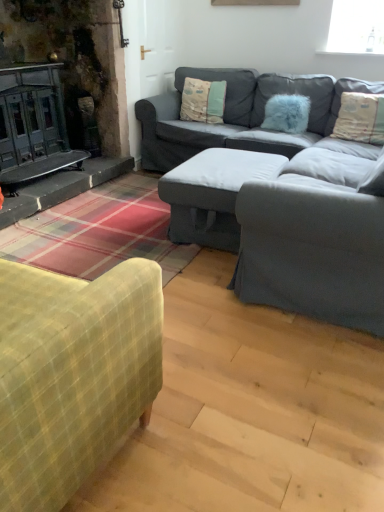
Where is `dark gray fabric couch at center`? dark gray fabric couch at center is located at coordinates (239, 115).

Where is `textured beige pillow at center, the first pillow in the left-to-right sequence`? The height and width of the screenshot is (512, 384). textured beige pillow at center, the first pillow in the left-to-right sequence is located at coordinates (203, 100).

What is the approximate width of fuzzy blue pillow at center, which is the second pillow from left to right?

It is 24.35 centimeters.

Locate an element on the screen. The width and height of the screenshot is (384, 512). fuzzy blue pillow at center, which is counted as the second pillow, starting from the right is located at coordinates (287, 113).

What is the approximate height of velvet green sofa at center?

velvet green sofa at center is 32.36 inches in height.

Where is `dark gray fabric couch at center`? This screenshot has height=512, width=384. dark gray fabric couch at center is located at coordinates (239, 115).

Measure the distance from dark gray fabric couch at center to white fabric ottoman at center.

dark gray fabric couch at center and white fabric ottoman at center are 30.28 inches apart.

Could you tell me if dark gray fabric couch at center is turned towards white fabric ottoman at center?

Yes.

How many degrees apart are the facing directions of dark gray fabric couch at center and white fabric ottoman at center?

The facing directions of dark gray fabric couch at center and white fabric ottoman at center are 87.4 degrees apart.

In terms of size, does dark gray fabric couch at center appear bigger or smaller than white fabric ottoman at center?

Clearly, dark gray fabric couch at center is larger in size than white fabric ottoman at center.

From the image's perspective, is fluffy cream pillow at upper right, which appears as the 1th pillow when viewed from the right, positioned above or below textured gray armchair at center?

fluffy cream pillow at upper right, which appears as the 1th pillow when viewed from the right, is above textured gray armchair at center.

Is fluffy cream pillow at upper right, which appears as the 1th pillow when viewed from the right, aimed at textured gray armchair at center?

Yes.

Is fluffy cream pillow at upper right, which appears as the 1th pillow when viewed from the right, wider than textured gray armchair at center?

No, fluffy cream pillow at upper right, which appears as the 1th pillow when viewed from the right, is not wider than textured gray armchair at center.

How different are the orientations of fluffy cream pillow at upper right, which appears as the 1th pillow when viewed from the right, and textured gray armchair at center in degrees?

88.6 degrees separate the facing orientations of fluffy cream pillow at upper right, which appears as the 1th pillow when viewed from the right, and textured gray armchair at center.

Which of these two, textured beige pillow at center, acting as the third pillow starting from the right, or velvet green sofa at center, is smaller?

textured beige pillow at center, acting as the third pillow starting from the right.

From the image's perspective, which one is positioned lower, textured beige pillow at center, acting as the third pillow starting from the right, or velvet green sofa at center?

velvet green sofa at center.

Is textured beige pillow at center, the first pillow in the left-to-right sequence, oriented towards velvet green sofa at center?

Yes, textured beige pillow at center, the first pillow in the left-to-right sequence, faces towards velvet green sofa at center.

From a real-world perspective, relative to velvet green sofa at center, is textured beige pillow at center, acting as the third pillow starting from the right, vertically above or below?

textured beige pillow at center, acting as the third pillow starting from the right, is situated higher than velvet green sofa at center in the real world.

In the scene shown: How different are the orientations of dark gray fabric couch at center and fluffy cream pillow at upper right, which appears as the 1th pillow when viewed from the right, in degrees?

1.49 degrees separate the facing orientations of dark gray fabric couch at center and fluffy cream pillow at upper right, which appears as the 1th pillow when viewed from the right.

Is dark gray fabric couch at center in front of or behind fluffy cream pillow at upper right, the third pillow positioned from the left, in the image?

Visually, dark gray fabric couch at center is located in front of fluffy cream pillow at upper right, the third pillow positioned from the left.

From a real-world perspective, is dark gray fabric couch at center over fluffy cream pillow at upper right, the third pillow positioned from the left?

No, from a real-world perspective, dark gray fabric couch at center is not over fluffy cream pillow at upper right, the third pillow positioned from the left

Considering the sizes of textured gray armchair at center and white fabric ottoman at center in the image, is textured gray armchair at center wider or thinner than white fabric ottoman at center?

Considering their sizes, textured gray armchair at center looks broader than white fabric ottoman at center.

Considering the relative sizes of textured gray armchair at center and white fabric ottoman at center in the image provided, is textured gray armchair at center taller than white fabric ottoman at center?

Yes.

Measure the distance from fuzzy blue pillow at center, which is counted as the second pillow, starting from the right, to fluffy cream pillow at upper right, the third pillow positioned from the left.

fuzzy blue pillow at center, which is counted as the second pillow, starting from the right, is 16.44 inches from fluffy cream pillow at upper right, the third pillow positioned from the left.

The height and width of the screenshot is (512, 384). What are the coordinates of `pillow in front of the fuzzy blue pillow at center, which is counted as the second pillow, starting from the right` in the screenshot? It's located at (360, 118).

Which of these two, fuzzy blue pillow at center, which is counted as the second pillow, starting from the right, or fluffy cream pillow at upper right, the third pillow positioned from the left, is wider?

fluffy cream pillow at upper right, the third pillow positioned from the left.

Considering their positions, is fuzzy blue pillow at center, which is the second pillow from left to right, located in front of or behind fluffy cream pillow at upper right, which appears as the 1th pillow when viewed from the right?

fuzzy blue pillow at center, which is the second pillow from left to right, is behind fluffy cream pillow at upper right, which appears as the 1th pillow when viewed from the right.

Considering the sizes of objects white fabric ottoman at center and fuzzy blue pillow at center, which is the second pillow from left to right, in the image provided, who is smaller, white fabric ottoman at center or fuzzy blue pillow at center, which is the second pillow from left to right,?

fuzzy blue pillow at center, which is the second pillow from left to right.

Between point (253, 174) and point (293, 112), which one is positioned in front?

Point (253, 174)

How different are the orientations of white fabric ottoman at center and fuzzy blue pillow at center, which is the second pillow from left to right, in degrees?

white fabric ottoman at center and fuzzy blue pillow at center, which is the second pillow from left to right, are facing 83.7 degrees away from each other.

Does white fabric ottoman at center have a lesser height compared to fuzzy blue pillow at center, which is counted as the second pillow, starting from the right?

No, white fabric ottoman at center is not shorter than fuzzy blue pillow at center, which is counted as the second pillow, starting from the right.

The image size is (384, 512). Find the location of `couch behind the white fabric ottoman at center`. couch behind the white fabric ottoman at center is located at coordinates (239, 115).

Identify the location of armchair in front of the fluffy cream pillow at upper right, the third pillow positioned from the left. Image resolution: width=384 pixels, height=512 pixels. (316, 239).

From the image, which object appears to be nearer to textured beige pillow at center, the first pillow in the left-to-right sequence, white fabric ottoman at center or dark gray fabric couch at center?

dark gray fabric couch at center is positioned closer to the anchor textured beige pillow at center, the first pillow in the left-to-right sequence.

Looking at the image, which one is located further to velvet green sofa at center, textured gray armchair at center or fuzzy blue pillow at center, which is the second pillow from left to right?

fuzzy blue pillow at center, which is the second pillow from left to right, is further to velvet green sofa at center.

When comparing their distances from fluffy cream pillow at upper right, which appears as the 1th pillow when viewed from the right, does dark gray fabric couch at center or textured beige pillow at center, acting as the third pillow starting from the right, seem closer?

Among the two, dark gray fabric couch at center is located nearer to fluffy cream pillow at upper right, which appears as the 1th pillow when viewed from the right.

Based on their spatial positions, is fluffy cream pillow at upper right, the third pillow positioned from the left, or white fabric ottoman at center further from textured beige pillow at center, acting as the third pillow starting from the right?

white fabric ottoman at center is positioned further to the anchor textured beige pillow at center, acting as the third pillow starting from the right.

Estimate the real-world distances between objects in this image. Which object is further from white fabric ottoman at center, fluffy cream pillow at upper right, the third pillow positioned from the left, or textured beige pillow at center, acting as the third pillow starting from the right?

textured beige pillow at center, acting as the third pillow starting from the right, lies further to white fabric ottoman at center than the other object.

From the image, which object appears to be farther from textured gray armchair at center, dark gray fabric couch at center or fuzzy blue pillow at center, which is the second pillow from left to right?

The object further to textured gray armchair at center is fuzzy blue pillow at center, which is the second pillow from left to right.

Looking at the image, which one is located further to fluffy cream pillow at upper right, which appears as the 1th pillow when viewed from the right, dark gray fabric couch at center or velvet green sofa at center?

Based on the image, velvet green sofa at center appears to be further to fluffy cream pillow at upper right, which appears as the 1th pillow when viewed from the right.

Looking at the image, which one is located closer to dark gray fabric couch at center, velvet green sofa at center or white fabric ottoman at center?

Based on the image, white fabric ottoman at center appears to be nearer to dark gray fabric couch at center.

What are the coordinates of `pillow between velvet green sofa at center and fuzzy blue pillow at center, which is counted as the second pillow, starting from the right, along the z-axis` in the screenshot? It's located at [360, 118].

What are the coordinates of `armchair located between velvet green sofa at center and white fabric ottoman at center in the depth direction` in the screenshot? It's located at (316, 239).

At what (x,y) coordinates should I click in order to perform the action: click on couch between velvet green sofa at center and textured beige pillow at center, the first pillow in the left-to-right sequence, along the z-axis. Please return your answer as a coordinate pair (x, y). Image resolution: width=384 pixels, height=512 pixels. Looking at the image, I should click on click(239, 115).

Image resolution: width=384 pixels, height=512 pixels. What are the coordinates of `armchair between velvet green sofa at center and textured beige pillow at center, the first pillow in the left-to-right sequence, in the front-back direction` in the screenshot? It's located at (316, 239).